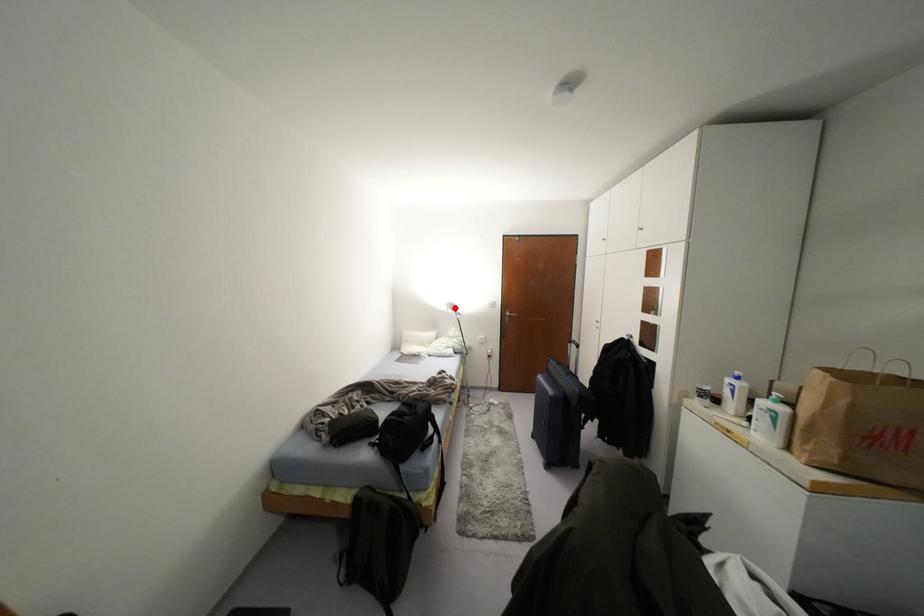
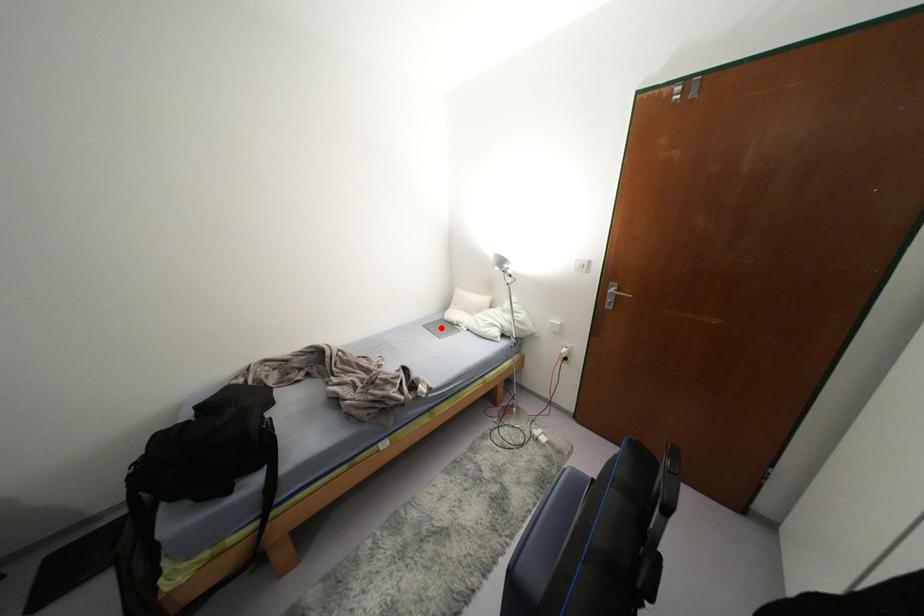
I am providing you with two images of the same scene from different viewpoints. A red point is marked on the first image and another point is marked on the second image. Are the points marked in image1 and image2 representing the same 3D position?

No